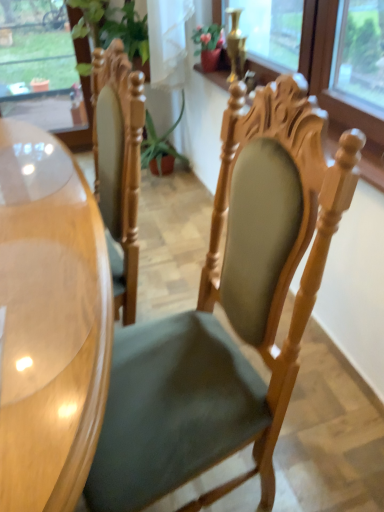
Locate an element on the screen. The width and height of the screenshot is (384, 512). transparent glass window at upper left is located at coordinates (37, 60).

Is transparent glass window at upper left a part of glossy wood desk at left?

No, transparent glass window at upper left is not surrounded by glossy wood desk at left.

Considering the positions of point (65, 478) and point (5, 87), is point (65, 478) closer or farther from the camera than point (5, 87)?

Clearly, point (65, 478) is closer to the camera than point (5, 87).

Is glossy wood desk at left far from transparent glass window at upper left?

That's right, there is a large distance between glossy wood desk at left and transparent glass window at upper left.

Is glossy wood desk at left to the right of transparent glass window at upper left from the viewer's perspective?

Yes.

Considering the relative positions of green fabric chair at center and transparent glass window at upper left in the image provided, is green fabric chair at center to the right of transparent glass window at upper left from the viewer's perspective?

Yes, green fabric chair at center is to the right of transparent glass window at upper left.

The image size is (384, 512). I want to click on chair in front of the transparent glass window at upper left, so click(229, 313).

Which is correct: green fabric chair at center is inside transparent glass window at upper left, or outside of it?

green fabric chair at center is located beyond the bounds of transparent glass window at upper left.

From the image's perspective, which is below, transparent glass window at upper left or glossy wood desk at left?

glossy wood desk at left, from the image's perspective.

How many degrees apart are the facing directions of transparent glass window at upper left and glossy wood desk at left?

89 degrees separate the facing orientations of transparent glass window at upper left and glossy wood desk at left.

Which of these two, transparent glass window at upper left or glossy wood desk at left, is thinner?

transparent glass window at upper left.

Image resolution: width=384 pixels, height=512 pixels. I want to click on desk in front of the transparent glass window at upper left, so click(50, 322).

Is green fabric chair at center next to glossy wood desk at left and touching it?

They are not placed beside each other.

Which of these two, green fabric chair at center or glossy wood desk at left, is bigger?

glossy wood desk at left is bigger.

Who is taller, green fabric chair at center or glossy wood desk at left?

With more height is green fabric chair at center.

Is glossy wood desk at left situated inside green fabric chair at center or outside?

glossy wood desk at left lies outside green fabric chair at center.

Can you confirm if glossy wood desk at left is positioned to the right of green fabric chair at center?

In fact, glossy wood desk at left is to the left of green fabric chair at center.

From the image's perspective, is glossy wood desk at left located above green fabric chair at center?

Yes, from the image's perspective, glossy wood desk at left is above green fabric chair at center.

Can you confirm if glossy wood desk at left is wider than green fabric chair at center?

No, glossy wood desk at left is not wider than green fabric chair at center.

How different are the orientations of transparent glass window at upper left and green fabric chair at center in degrees?

The angle between the facing direction of transparent glass window at upper left and the facing direction of green fabric chair at center is 80.6 degrees.

This screenshot has height=512, width=384. I want to click on window that appears on the left of green fabric chair at center, so click(37, 60).

From the image's perspective, does transparent glass window at upper left appear lower than green fabric chair at center?

No, from the image's perspective, transparent glass window at upper left is not below green fabric chair at center.

Identify the location of desk in front of the transparent glass window at upper left. (50, 322).

Where is `chair that appears below the transparent glass window at upper left (from a real-world perspective)`? The width and height of the screenshot is (384, 512). chair that appears below the transparent glass window at upper left (from a real-world perspective) is located at coordinates (229, 313).

When comparing their distances from green fabric chair at center, does glossy wood desk at left or transparent glass window at upper left seem closer?

Based on the image, glossy wood desk at left appears to be nearer to green fabric chair at center.

Which object lies nearer to the anchor point transparent glass window at upper left, green fabric chair at center or glossy wood desk at left?

The object closer to transparent glass window at upper left is glossy wood desk at left.

From the image, which object appears to be farther from glossy wood desk at left, green fabric chair at center or transparent glass window at upper left?

transparent glass window at upper left is further to glossy wood desk at left.

Based on their spatial positions, is transparent glass window at upper left or green fabric chair at center closer to glossy wood desk at left?

Based on the image, green fabric chair at center appears to be nearer to glossy wood desk at left.

Looking at the image, which one is located further to transparent glass window at upper left, glossy wood desk at left or green fabric chair at center?

The object further to transparent glass window at upper left is green fabric chair at center.

Which object lies nearer to the anchor point green fabric chair at center, transparent glass window at upper left or glossy wood desk at left?

Among the two, glossy wood desk at left is located nearer to green fabric chair at center.

The height and width of the screenshot is (512, 384). Find the location of `chair between glossy wood desk at left and transparent glass window at upper left from front to back`. chair between glossy wood desk at left and transparent glass window at upper left from front to back is located at coordinates (229, 313).